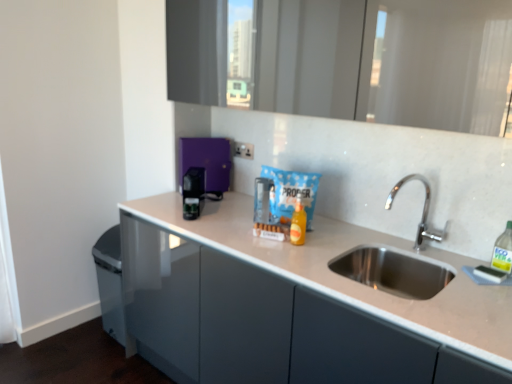
Question: Does green translucent bottle at right, which appears as the 1th bottle when viewed from the right, touch translucent orange bottle at center, which is counted as the first bottle, starting from the left?

Choices:
 (A) no
 (B) yes

Answer: (A)

Question: Is the position of green translucent bottle at right, which is the 2th bottle in back-to-front order, less distant than that of translucent orange bottle at center, which is the first bottle from back to front?

Choices:
 (A) yes
 (B) no

Answer: (A)

Question: From a real-world perspective, is green translucent bottle at right, which is the 2th bottle in back-to-front order, physically below translucent orange bottle at center, which is the first bottle from back to front?

Choices:
 (A) yes
 (B) no

Answer: (B)

Question: Does green translucent bottle at right, which appears as the 1th bottle when viewed from the right, appear on the left side of translucent orange bottle at center, the second bottle positioned from the front?

Choices:
 (A) yes
 (B) no

Answer: (B)

Question: Is green translucent bottle at right, which is the 2th bottle in left-to-right order, positioned far away from translucent orange bottle at center, which is the first bottle from back to front?

Choices:
 (A) no
 (B) yes

Answer: (A)

Question: Is green translucent bottle at right, which is the 2th bottle in back-to-front order, positioned with its back to translucent orange bottle at center, the second bottle positioned from the front?

Choices:
 (A) yes
 (B) no

Answer: (B)

Question: Can you confirm if translucent orange bottle at center, which is the first bottle from back to front, is bigger than green translucent bottle at right, which is the first bottle from front to back?

Choices:
 (A) yes
 (B) no

Answer: (B)

Question: Can you confirm if translucent orange bottle at center, the second bottle positioned from the right, is positioned to the left of green translucent bottle at right, which is the first bottle from front to back?

Choices:
 (A) yes
 (B) no

Answer: (A)

Question: Is translucent orange bottle at center, which is the first bottle from back to front, far from green translucent bottle at right, which appears as the 1th bottle when viewed from the right?

Choices:
 (A) yes
 (B) no

Answer: (B)

Question: Considering the relative sizes of translucent orange bottle at center, which is counted as the first bottle, starting from the left, and green translucent bottle at right, which is the first bottle from front to back, in the image provided, is translucent orange bottle at center, which is counted as the first bottle, starting from the left, wider than green translucent bottle at right, which is the first bottle from front to back,?

Choices:
 (A) yes
 (B) no

Answer: (B)

Question: Is translucent orange bottle at center, which is counted as the first bottle, starting from the left, positioned before green translucent bottle at right, which appears as the 1th bottle when viewed from the right?

Choices:
 (A) yes
 (B) no

Answer: (B)

Question: Is translucent orange bottle at center, the second bottle positioned from the right, taller than green translucent bottle at right, which is the 2th bottle in left-to-right order?

Choices:
 (A) yes
 (B) no

Answer: (B)

Question: Can you confirm if green translucent bottle at right, which appears as the 1th bottle when viewed from the right, is shorter than black plastic coffee machine at center, acting as the 2th appliance starting from the back?

Choices:
 (A) yes
 (B) no

Answer: (A)